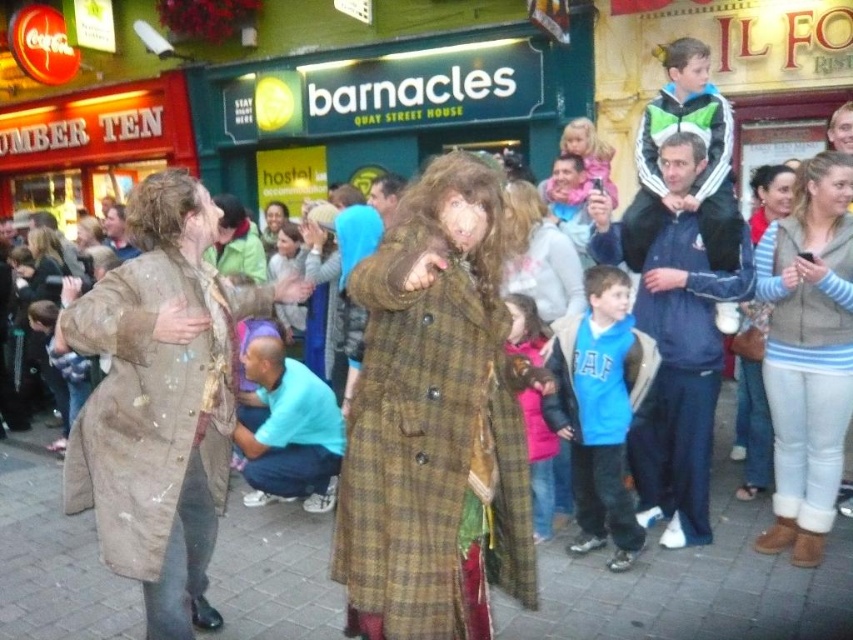
Question: Which is nearer to the light gray fleece vest at right?

Choices:
 (A) striped sweater at center
 (B) brown plaid coat at center
 (C) pink fleece jacket at center
 (D) dark blue jacket at center

Answer: (D)

Question: Is the position of brown textured coat at left less distant than that of brown wool coat at center?

Choices:
 (A) no
 (B) yes

Answer: (B)

Question: Which point is closer to the camera?

Choices:
 (A) dark blue jacket at center
 (B) pink fleece jacket at center
 (C) striped sweater at center

Answer: (B)

Question: Is brown textured coat at left below blue cotton shirt at lower left?

Choices:
 (A) no
 (B) yes

Answer: (A)

Question: Can you confirm if dark blue jacket at center is thinner than striped sweater at center?

Choices:
 (A) yes
 (B) no

Answer: (B)

Question: Which of the following is the closest to the observer?

Choices:
 (A) blue cotton shirt at lower left
 (B) striped sweater at center
 (C) brown plaid coat at center
 (D) brown textured coat at left

Answer: (C)